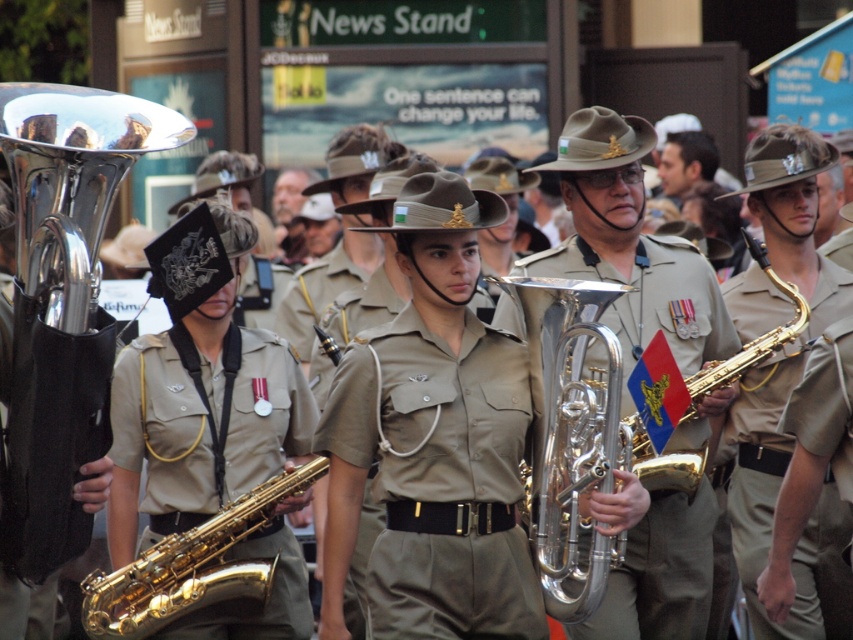
Is khaki fabric uniform at center wider than gold shiny saxophone at center?

No, khaki fabric uniform at center is not wider than gold shiny saxophone at center.

Who is positioned more to the left, khaki fabric uniform at center or gold shiny saxophone at center?

gold shiny saxophone at center is more to the left.

The height and width of the screenshot is (640, 853). Identify the location of khaki fabric uniform at center. (780, 483).

Identify the location of khaki fabric uniform at center. The height and width of the screenshot is (640, 853). (780, 483).

Is olive green fabric uniform at center above khaki fabric uniform at center?

Yes, olive green fabric uniform at center is above khaki fabric uniform at center.

Who is more forward, (439, 397) or (724, 292)?

Positioned in front is point (439, 397).

Find the location of a particular element. The height and width of the screenshot is (640, 853). olive green fabric uniform at center is located at coordinates (440, 476).

At what (x,y) coordinates should I click in order to perform the action: click on olive green fabric uniform at center. Please return your answer as a coordinate pair (x, y). Looking at the image, I should click on (440, 476).

What do you see at coordinates (440, 476) in the screenshot?
I see `olive green fabric uniform at center` at bounding box center [440, 476].

From the picture: Which of these two, olive green fabric uniform at center or gold shiny saxophone at center, stands taller?

Standing taller between the two is gold shiny saxophone at center.

You are a GUI agent. You are given a task and a screenshot of the screen. Output one action in this format:
    pyautogui.click(x=<x>, y=<y>)
    Task: Click on the olive green fabric uniform at center
    This screenshot has height=640, width=853.
    Given the screenshot: What is the action you would take?
    pyautogui.click(x=440, y=476)